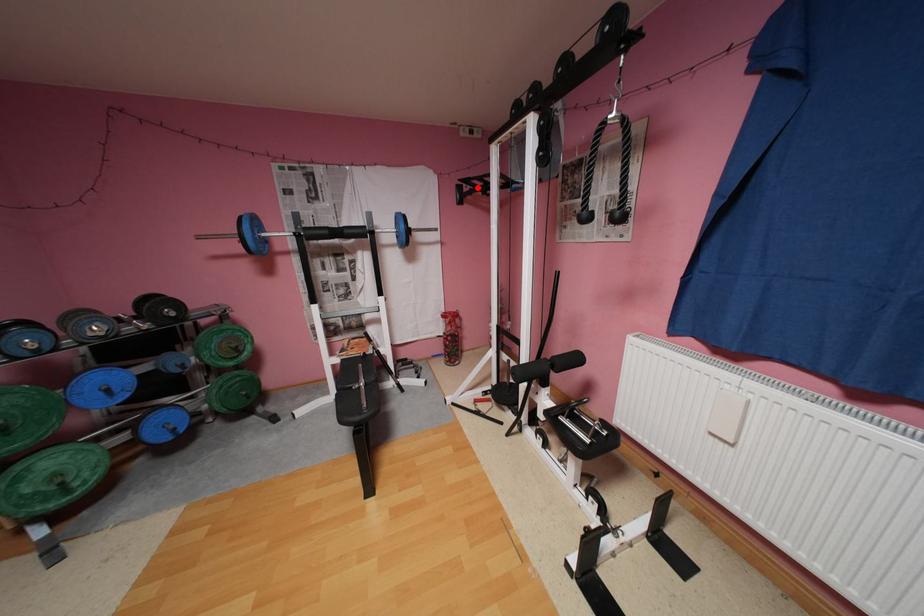
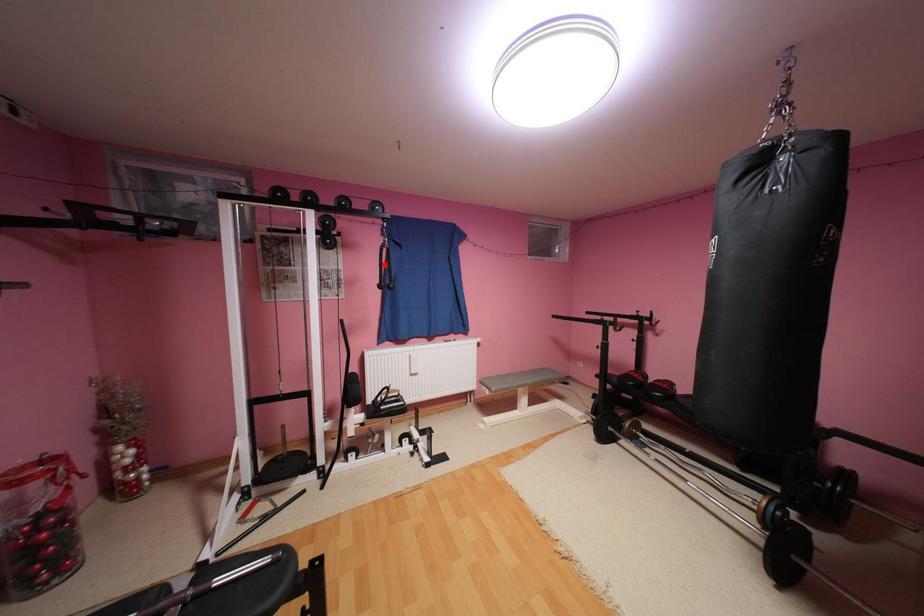
I am providing you with two images of the same scene from different viewpoints. A red point is marked on the first image and another point is marked on the second image. Is the red point in image1 aligned with the point shown in image2?

No